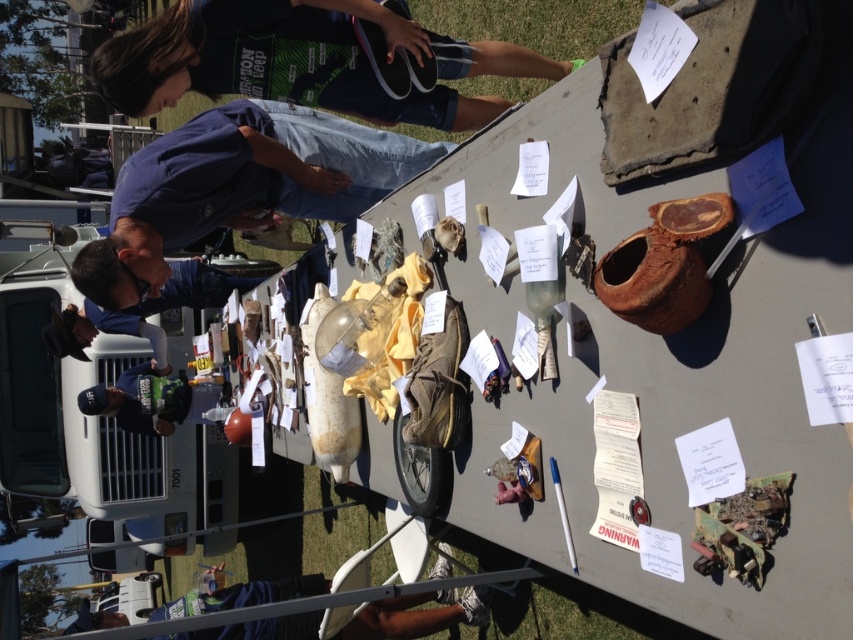
Is the position of blue denim jeans at upper center less distant than that of blue fabric shirt at lower left?

Yes, it is in front of blue fabric shirt at lower left.

The width and height of the screenshot is (853, 640). Describe the element at coordinates (238, 186) in the screenshot. I see `blue denim jeans at upper center` at that location.

Is point (155, 257) positioned behind point (241, 602)?

No, (155, 257) is in front of (241, 602).

You are a GUI agent. You are given a task and a screenshot of the screen. Output one action in this format:
    pyautogui.click(x=<x>, y=<y>)
    Task: Click on the blue denim jeans at upper center
    The width and height of the screenshot is (853, 640).
    Given the screenshot: What is the action you would take?
    pyautogui.click(x=238, y=186)

Which is more to the right, dark blue shirt at upper left or blue fabric shirt at lower left?

dark blue shirt at upper left

Does dark blue shirt at upper left appear on the left side of blue fabric shirt at lower left?

Incorrect, dark blue shirt at upper left is not on the left side of blue fabric shirt at lower left.

Does point (480, 42) come farther from viewer compared to point (320, 577)?

No, it is not.

At what (x,y) coordinates should I click in order to perform the action: click on dark blue shirt at upper left. Please return your answer as a coordinate pair (x, y). The image size is (853, 640). Looking at the image, I should click on (300, 61).

Which is in front, point (450, 104) or point (151, 179)?

Point (151, 179) is more forward.

Can you confirm if dark blue shirt at upper left is taller than blue denim jeans at upper center?

Incorrect, dark blue shirt at upper left's height is not larger of blue denim jeans at upper center's.

This screenshot has width=853, height=640. I want to click on dark blue shirt at upper left, so click(300, 61).

The image size is (853, 640). Identify the location of dark blue shirt at upper left. (300, 61).